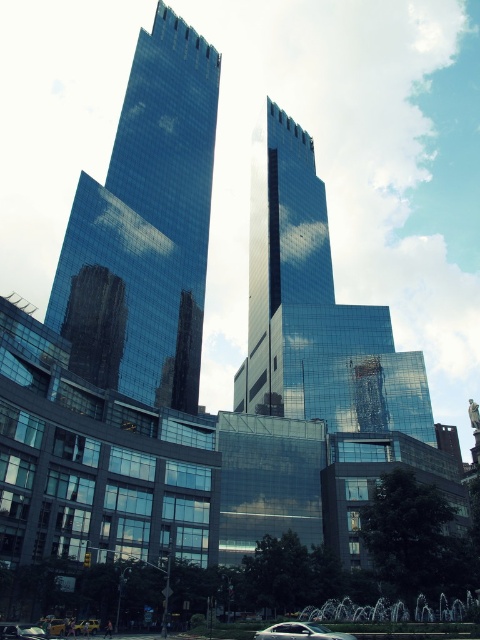
You are a city planner evaluating the urban layout. Given the glossy glass tower at left and the sleek silver sedan at lower center, which object occupies a greater spatial footprint in the image?

The glossy glass tower at left has a larger size compared to the sleek silver sedan at lower center, so it occupies a greater spatial footprint in the image.

You are standing in the city and want to take a photo of the glossy glass tower at left. The camera you have can focus on objects up to 70 meters away. Will the tower be in focus?

The glossy glass tower at left is 68.97 meters away from viewer, so yes, the tower will be in focus since it is within the camera focus range of up to 70 meters.

You are standing in front of the modern urban landscape and want to take a photo. There are two points marked in the image, point 1 at coordinates point [268,202] and point 2 at coordinates point [291,630]. Which point will appear closer to you in the photo?

Point [268,202] is further to the camera than point [291,630], so in the photo, point [291,630] will appear closer to you.